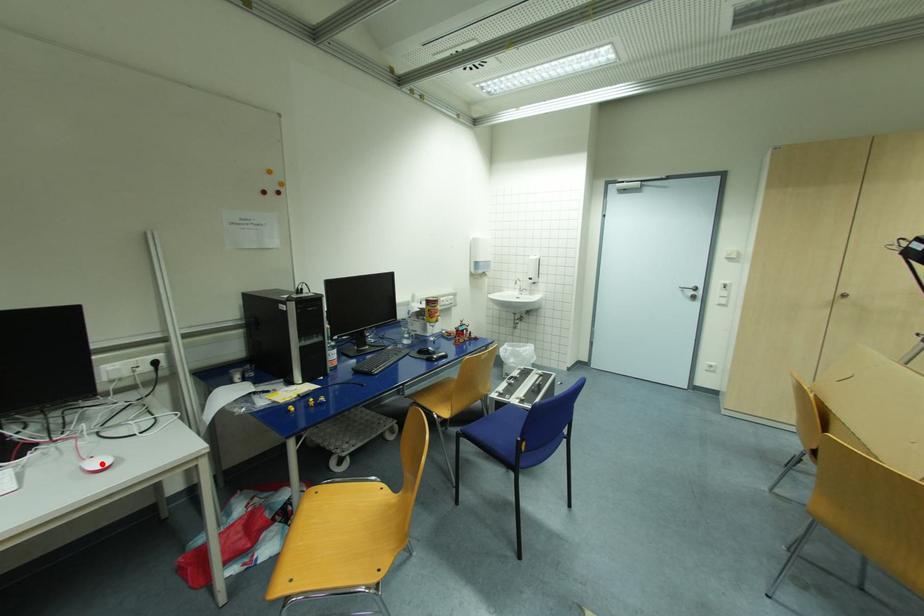
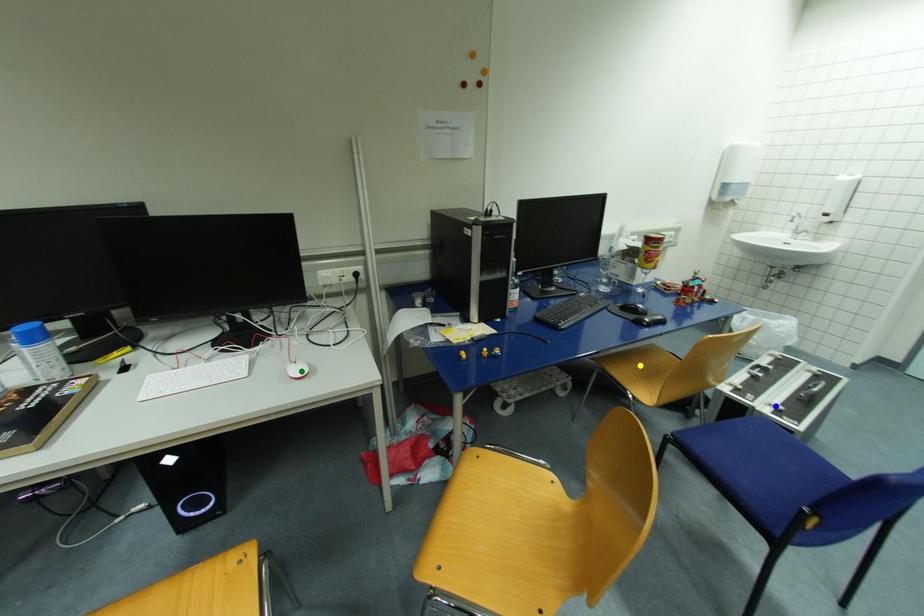
Question: I am providing you with two images of the same scene from different viewpoints. A red point is marked on the first image. You are given multiple points on the second image. Which mark in image 2 goes with the point in image 1?

Choices:
 (A) blue point
 (B) yellow point
 (C) green point

Answer: (C)